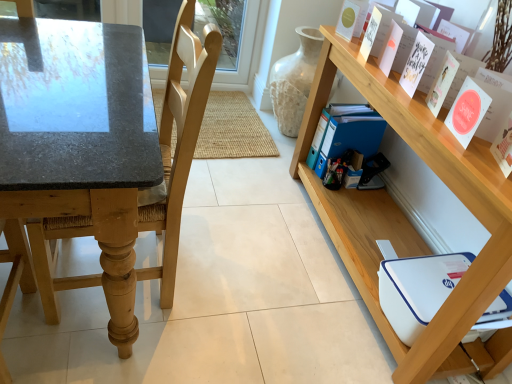
Describe the element at coordinates (366, 48) in the screenshot. The width and height of the screenshot is (512, 384). I see `white paper card at upper right` at that location.

Locate an element on the screen. blue plastic folder at lower right, which is counted as the fifth paperback book, starting from the front is located at coordinates (345, 134).

How much space does white paper at upper right, positioned as the fourth paperback book in back-to-front order, occupy horizontally?

white paper at upper right, positioned as the fourth paperback book in back-to-front order, is 2.30 inches wide.

I want to click on white paper card at upper right, so click(366, 48).

Is wooden shelf at upper right at the left side of white paper at upper right, the 3th paperback book when ordered from front to back?

No.

You are a GUI agent. You are given a task and a screenshot of the screen. Output one action in this format:
    pyautogui.click(x=<x>, y=<y>)
    Task: Click on the shelf that appears below the white paper at upper right, positioned as the fourth paperback book in back-to-front order (from a real-world perspective)
    
    Given the screenshot: What is the action you would take?
    pyautogui.click(x=403, y=214)

Considering the sizes of objects wooden shelf at upper right and white paper at upper right, positioned as the fourth paperback book in back-to-front order, in the image provided, who is smaller, wooden shelf at upper right or white paper at upper right, positioned as the fourth paperback book in back-to-front order,?

Smaller between the two is white paper at upper right, positioned as the fourth paperback book in back-to-front order.

How many degrees apart are the facing directions of wooden shelf at upper right and white paper at upper right, the 3th paperback book when ordered from front to back?

wooden shelf at upper right and white paper at upper right, the 3th paperback book when ordered from front to back, are facing 9.01 degrees away from each other.

Which is nearer, (329,96) or (508,167)?

Point (329,96) appears to be farther away from the viewer than point (508,167).

From a real-world perspective, which object stands above the other?

white matte paper at upper right, marked as the 6th paperback book in a back-to-front arrangement.

Which object is more forward, translucent glass vase at upper right or white matte paper at upper right, which appears as the 1th paperback book when viewed from the front?

white matte paper at upper right, which appears as the 1th paperback book when viewed from the front, is in front.

Relative to pink matte paper at upper right, the 3th paperback book viewed from the back, is wooden shelf at upper right in front or behind?

Visually, wooden shelf at upper right is located in front of pink matte paper at upper right, the 3th paperback book viewed from the back.

Which point is more forward, (501, 277) or (401, 64)?

Positioned in front is point (501, 277).

Is wooden shelf at upper right positioned with its back to pink matte paper at upper right, placed as the fourth paperback book when sorted from front to back?

No, wooden shelf at upper right is not facing the opposite direction of pink matte paper at upper right, placed as the fourth paperback book when sorted from front to back.

Based on their sizes in the image, would you say wooden shelf at upper right is bigger or smaller than pink matte paper at upper right, the 3th paperback book viewed from the back?

Considering their sizes, wooden shelf at upper right takes up more space than pink matte paper at upper right, the 3th paperback book viewed from the back.

Is white matte paper at upper right, which appears as the 1th paperback book when viewed from the front, oriented towards pink matte paper at upper right, the 3th paperback book viewed from the back?

No, white matte paper at upper right, which appears as the 1th paperback book when viewed from the front, is not facing towards pink matte paper at upper right, the 3th paperback book viewed from the back.

Considering the relative sizes of white matte paper at upper right, which appears as the 1th paperback book when viewed from the front, and pink matte paper at upper right, the 3th paperback book viewed from the back, in the image provided, is white matte paper at upper right, which appears as the 1th paperback book when viewed from the front, thinner than pink matte paper at upper right, the 3th paperback book viewed from the back,?

In fact, white matte paper at upper right, which appears as the 1th paperback book when viewed from the front, might be wider than pink matte paper at upper right, the 3th paperback book viewed from the back.

From a real-world perspective, is white matte paper at upper right, which appears as the 1th paperback book when viewed from the front, positioned above or below pink matte paper at upper right, the 3th paperback book viewed from the back?

In terms of real-world spatial position, white matte paper at upper right, which appears as the 1th paperback book when viewed from the front, is below pink matte paper at upper right, the 3th paperback book viewed from the back.

Does white matte paper at upper right, which appears as the 1th paperback book when viewed from the front, appear on the left side of pink matte paper at upper right, the 3th paperback book viewed from the back?

No.

Does point (292, 86) appear closer or farther from the camera than point (421, 47)?

Point (292, 86).

Considering the sizes of objects translucent glass vase at upper right and white paper at upper right, the 3th paperback book when ordered from front to back, in the image provided, who is bigger, translucent glass vase at upper right or white paper at upper right, the 3th paperback book when ordered from front to back,?

With larger size is translucent glass vase at upper right.

Which object is positioned more to the right, translucent glass vase at upper right or white paper at upper right, the 3th paperback book when ordered from front to back?

white paper at upper right, the 3th paperback book when ordered from front to back.

From a real-world perspective, is translucent glass vase at upper right located beneath white paper at upper right, positioned as the fourth paperback book in back-to-front order?

Yes, from a real-world perspective, translucent glass vase at upper right is below white paper at upper right, positioned as the fourth paperback book in back-to-front order.

From the image's perspective, which is below, white paper card at upper right or blue plastic folder at lower right, which is counted as the fifth paperback book, starting from the front?

blue plastic folder at lower right, which is counted as the fifth paperback book, starting from the front, is shown below in the image.

Is white paper card at upper right outside of blue plastic folder at lower right, which is counted as the fifth paperback book, starting from the front?

Yes.

In terms of height, does white paper card at upper right look taller or shorter compared to blue plastic folder at lower right, which is counted as the fifth paperback book, starting from the front?

Considering their sizes, white paper card at upper right has more height than blue plastic folder at lower right, which is counted as the fifth paperback book, starting from the front.

The height and width of the screenshot is (384, 512). What are the coordinates of `paperback book that is the 5th one below the white paper card at upper right (from a real-world perspective)` in the screenshot? It's located at (345, 134).

How different are the orientations of light wood chair at left and translucent glass vase at upper right in degrees?

They differ by 0.327 degrees in their facing directions.

From the image's perspective, which one is positioned higher, light wood chair at left or translucent glass vase at upper right?

translucent glass vase at upper right appears higher in the image.

The image size is (512, 384). I want to click on chair in front of the translucent glass vase at upper right, so click(179, 140).

Is point (188, 19) farther from camera compared to point (319, 51)?

That is False.

Where is `shelf below the white paper at upper right, the 3th paperback book when ordered from front to back (from the image's perspective)`? The image size is (512, 384). shelf below the white paper at upper right, the 3th paperback book when ordered from front to back (from the image's perspective) is located at coordinates (403, 214).

I want to click on glass vase above the white matte paper at upper right, which appears as the 1th paperback book when viewed from the front (from the image's perspective), so click(x=294, y=81).

Which object lies nearer to the anchor point blue plastic folder at lower right, which is counted as the fifth paperback book, starting from the front, wooden shelf at upper right or white paper at upper right, positioned as the fourth paperback book in back-to-front order?

wooden shelf at upper right lies closer to blue plastic folder at lower right, which is counted as the fifth paperback book, starting from the front, than the other object.

Which object lies further to the anchor point white matte paper at upper right, marked as the 6th paperback book in a back-to-front arrangement, translucent glass vase at upper right or wooden shelf at upper right?

translucent glass vase at upper right is further to white matte paper at upper right, marked as the 6th paperback book in a back-to-front arrangement.

Considering their positions, is wooden shelf at upper right positioned closer to white paper card at upper right than white matte paper at upper right, which appears as the 1th paperback book when viewed from the front?

white matte paper at upper right, which appears as the 1th paperback book when viewed from the front, is closer to white paper card at upper right.

Estimate the real-world distances between objects in this image. Which object is further from white matte paper at upper right, which appears as the 1th paperback book when viewed from the front, pink matte paper at upper right, placed as the fourth paperback book when sorted from front to back, or matte pink card at upper right, the 2th paperback book viewed from the front?

pink matte paper at upper right, placed as the fourth paperback book when sorted from front to back, is further to white matte paper at upper right, which appears as the 1th paperback book when viewed from the front.

Considering their positions, is white matte paper at upper right, marked as the 6th paperback book in a back-to-front arrangement, positioned closer to matte pink card at upper right, which is the fifth paperback book in back-to-front order, than blue plastic folder at lower right, which is counted as the fifth paperback book, starting from the front?

white matte paper at upper right, marked as the 6th paperback book in a back-to-front arrangement, is positioned closer to the anchor matte pink card at upper right, which is the fifth paperback book in back-to-front order.

From the image, which object appears to be farther from blue plastic folder at center-right, the first paperback book viewed from the back, blue plastic folder at lower right, which appears as the second paperback book when viewed from the back, or pink matte paper at upper right, placed as the fourth paperback book when sorted from front to back?

The object further to blue plastic folder at center-right, the first paperback book viewed from the back, is pink matte paper at upper right, placed as the fourth paperback book when sorted from front to back.

When comparing their distances from matte pink card at upper right, which is the fifth paperback book in back-to-front order, does pink matte paper at upper right, the 3th paperback book viewed from the back, or wooden shelf at upper right seem closer?

pink matte paper at upper right, the 3th paperback book viewed from the back, is positioned closer to the anchor matte pink card at upper right, which is the fifth paperback book in back-to-front order.

Considering their positions, is white matte paper at upper right, which appears as the 1th paperback book when viewed from the front, positioned closer to blue plastic folder at center-right, which appears as the sixth paperback book when viewed from the front, than blue plastic folder at lower right, which appears as the second paperback book when viewed from the back?

blue plastic folder at lower right, which appears as the second paperback book when viewed from the back, lies closer to blue plastic folder at center-right, which appears as the sixth paperback book when viewed from the front, than the other object.

Identify the location of shelf located between white paper card at upper right and pink matte paper at upper right, the 3th paperback book viewed from the back, in the depth direction. (403, 214).

The image size is (512, 384). What are the coordinates of `paperback book between white paper at upper right, the 3th paperback book when ordered from front to back, and blue plastic folder at lower right, which is counted as the fifth paperback book, starting from the front, along the z-axis` in the screenshot? It's located at (396, 47).

The width and height of the screenshot is (512, 384). I want to click on book located between light wood chair at left and blue plastic folder at lower right, which is counted as the fifth paperback book, starting from the front, in the depth direction, so click(366, 48).

Locate an element on the screen. Image resolution: width=512 pixels, height=384 pixels. shelf between light wood chair at left and blue plastic folder at center-right, which appears as the sixth paperback book when viewed from the front, from front to back is located at coordinates (403, 214).